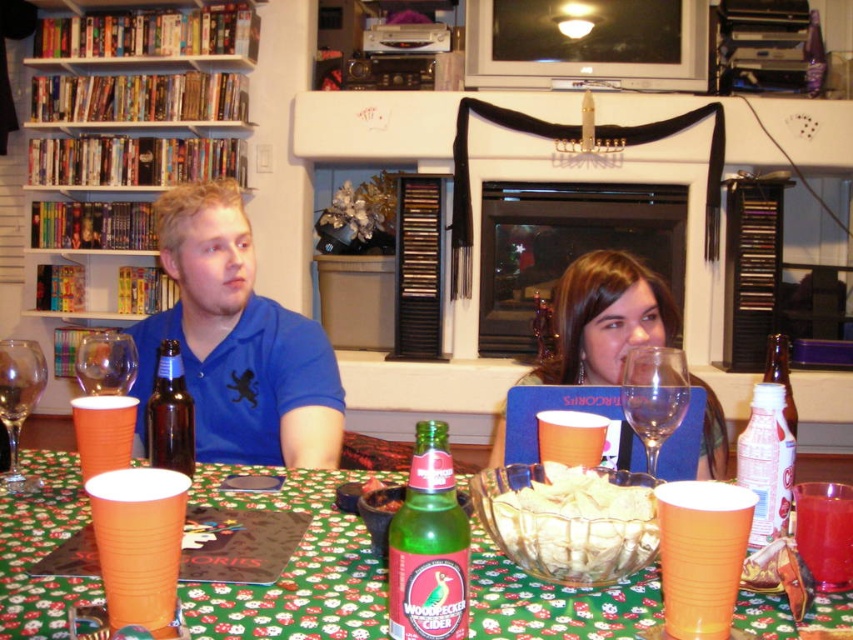
Question: Which object is positioned farthest from the green glass beer bottle at center?

Choices:
 (A) transparent glass wine glass at center
 (B) translucent glass bowl at center
 (C) transparent glass wine glass at left
 (D) matte blue shirt at center

Answer: (C)

Question: Does orange plastic cup at lower left appear under transparent glass wine glass at center?

Choices:
 (A) no
 (B) yes

Answer: (B)

Question: Can you confirm if matte blue laptop at center is smaller than transparent glass at center?

Choices:
 (A) no
 (B) yes

Answer: (A)

Question: Which object appears farthest from the camera in this image?

Choices:
 (A) translucent plastic cup at table center
 (B) green glass bottle at table
 (C) orange plastic cup at lower center

Answer: (A)

Question: Can you confirm if green glass bottle at table is positioned to the right of transparent glass wine glass at left?

Choices:
 (A) no
 (B) yes

Answer: (B)

Question: Which of the following is the farthest from the observer?

Choices:
 (A) wooden bookshelf at left
 (B) green glass bottle at center

Answer: (A)